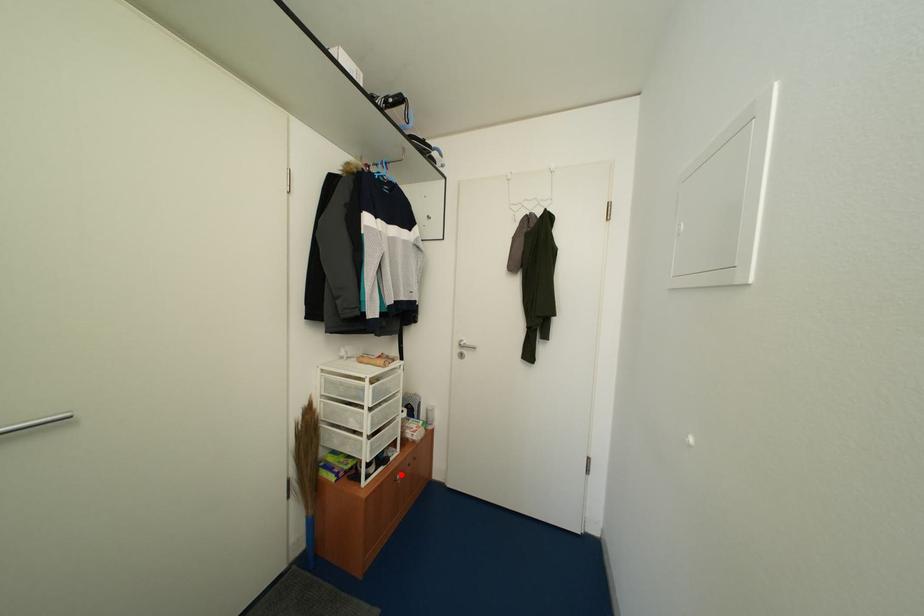
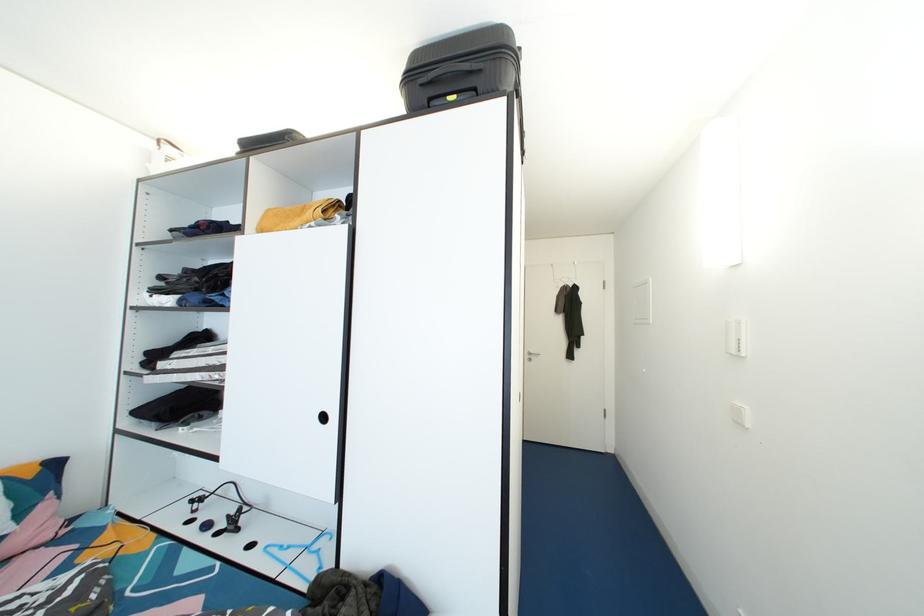
Question: I am providing you with two images of the same scene from different viewpoints. A red point is marked on the first image. Can you still see the location of the red point in image 2?

Choices:
 (A) Yes
 (B) No

Answer: (B)